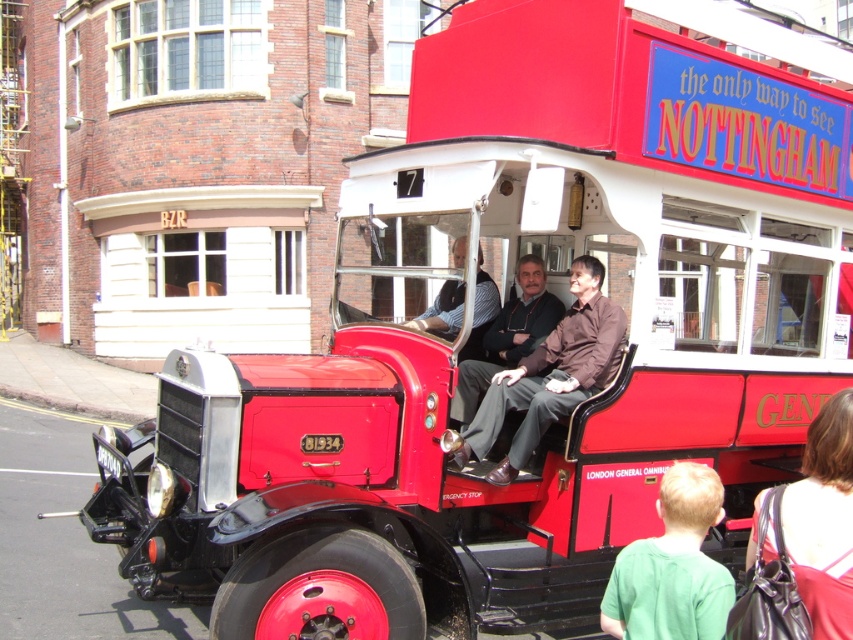
Does matte black jacket at center appear over striped shirt at center?

No, matte black jacket at center is not above striped shirt at center.

Which is behind, point (486, 358) or point (489, 308)?

The point (486, 358) is behind.

Locate an element on the screen. matte black jacket at center is located at coordinates (508, 337).

Between brown smooth shirt at center and striped shirt at center, which one is positioned higher?

striped shirt at center

Who is lower down, brown smooth shirt at center or striped shirt at center?

Positioned lower is brown smooth shirt at center.

Image resolution: width=853 pixels, height=640 pixels. Identify the location of brown smooth shirt at center. (550, 376).

I want to click on brown smooth shirt at center, so click(x=550, y=376).

Is green matte shirt at lower right to the left of red leather handbag at lower right from the viewer's perspective?

Yes, green matte shirt at lower right is to the left of red leather handbag at lower right.

Is green matte shirt at lower right bigger than red leather handbag at lower right?

Actually, green matte shirt at lower right might be smaller than red leather handbag at lower right.

The image size is (853, 640). I want to click on green matte shirt at lower right, so click(x=672, y=566).

The width and height of the screenshot is (853, 640). I want to click on green matte shirt at lower right, so click(672, 566).